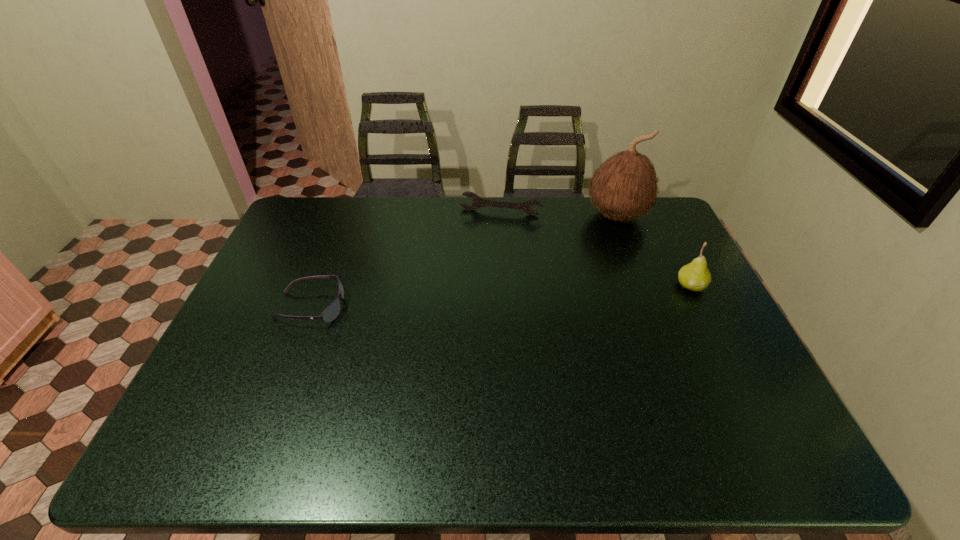
Locate an element on the screen. The width and height of the screenshot is (960, 540). free space on the desktop that is between the sunglasses and the pear and is positioned on the open ends of the third object from right to left is located at coordinates (481, 298).

Find the location of `free space on the desktop that is between the sunglasses and the second tallest object and is positioned on the surface of the tallest object`. free space on the desktop that is between the sunglasses and the second tallest object and is positioned on the surface of the tallest object is located at coordinates (562, 293).